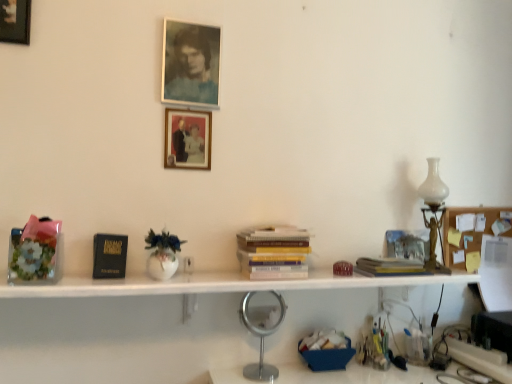
Question: Is matte glass photo frame at upper center, the second picture frame viewed from the back, taller than black matte paperback book at left?

Choices:
 (A) no
 (B) yes

Answer: (B)

Question: Is matte glass photo frame at upper center, the third picture frame in the left-to-right sequence, oriented towards black matte paperback book at left?

Choices:
 (A) no
 (B) yes

Answer: (A)

Question: Is matte glass photo frame at upper center, arranged as the 1th picture frame when viewed from the right, further to camera compared to black matte paperback book at left?

Choices:
 (A) no
 (B) yes

Answer: (B)

Question: Can you confirm if matte glass photo frame at upper center, arranged as the 2th picture frame when ordered from the bottom, is positioned to the right of black matte paperback book at left?

Choices:
 (A) no
 (B) yes

Answer: (B)

Question: Is matte glass photo frame at upper center, placed as the 2th picture frame when sorted from front to back, looking in the opposite direction of black matte paperback book at left?

Choices:
 (A) no
 (B) yes

Answer: (A)

Question: Is matte glass photo frame at upper center, arranged as the 2th picture frame when ordered from the bottom, situated inside wooden picture frame at upper left, marked as the 3th picture frame in a bottom-to-top arrangement, or outside?

Choices:
 (A) inside
 (B) outside

Answer: (B)

Question: From the image's perspective, relative to wooden picture frame at upper left, marked as the 3th picture frame in a bottom-to-top arrangement, is matte glass photo frame at upper center, placed as the 2th picture frame when sorted from front to back, above or below?

Choices:
 (A) above
 (B) below

Answer: (B)

Question: Is point (177, 51) closer or farther from the camera than point (26, 31)?

Choices:
 (A) closer
 (B) farther

Answer: (B)

Question: Looking at their shapes, would you say matte glass photo frame at upper center, the second picture frame viewed from the back, is wider or thinner than wooden picture frame at upper left, which is the 1th picture frame from front to back?

Choices:
 (A) thin
 (B) wide

Answer: (B)

Question: From a real-world perspective, relative to wooden picture frame at upper left, which appears as the first picture frame when viewed from the top, is matte wooden picture frame at center, acting as the first picture frame starting from the bottom, vertically above or below?

Choices:
 (A) above
 (B) below

Answer: (B)

Question: In terms of size, does matte wooden picture frame at center, acting as the first picture frame starting from the bottom, appear bigger or smaller than wooden picture frame at upper left, which is the third picture frame from right to left?

Choices:
 (A) small
 (B) big

Answer: (A)

Question: Would you say matte wooden picture frame at center, which is counted as the second picture frame, starting from the left, is inside or outside wooden picture frame at upper left, which appears as the first picture frame when viewed from the top?

Choices:
 (A) outside
 (B) inside

Answer: (A)

Question: Considering their positions, is matte wooden picture frame at center, acting as the first picture frame starting from the bottom, located in front of or behind wooden picture frame at upper left, which is the third picture frame in back-to-front order?

Choices:
 (A) behind
 (B) front

Answer: (A)

Question: Considering the positions of point (473, 208) and point (5, 23), is point (473, 208) closer or farther from the camera than point (5, 23)?

Choices:
 (A) farther
 (B) closer

Answer: (A)

Question: From the image's perspective, is wooden memo board at right above or below wooden picture frame at upper left, which is the third picture frame from right to left?

Choices:
 (A) below
 (B) above

Answer: (A)